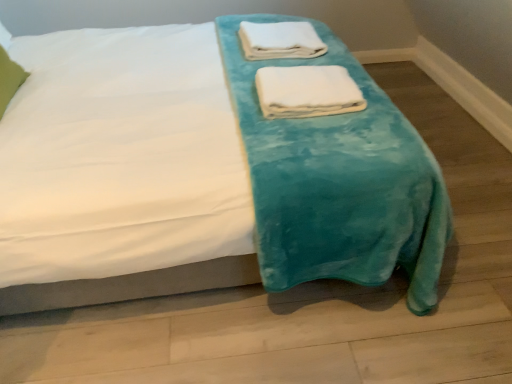
Question: Which direction should I rotate to look at white soft towel at center, acting as the 2th towel starting from the top, — up or down?

Choices:
 (A) up
 (B) down

Answer: (A)

Question: Considering the relative sizes of green fabric pillow at upper left and teal plush blanket at center in the image provided, is green fabric pillow at upper left bigger than teal plush blanket at center?

Choices:
 (A) no
 (B) yes

Answer: (A)

Question: Considering the relative sizes of green fabric pillow at upper left and teal plush blanket at center in the image provided, is green fabric pillow at upper left shorter than teal plush blanket at center?

Choices:
 (A) yes
 (B) no

Answer: (A)

Question: Is green fabric pillow at upper left to the left of teal plush blanket at center from the viewer's perspective?

Choices:
 (A) yes
 (B) no

Answer: (A)

Question: From the image's perspective, is green fabric pillow at upper left on teal plush blanket at center?

Choices:
 (A) no
 (B) yes

Answer: (B)

Question: From a real-world perspective, is green fabric pillow at upper left over teal plush blanket at center?

Choices:
 (A) no
 (B) yes

Answer: (B)

Question: Is green fabric pillow at upper left wider than teal plush blanket at center?

Choices:
 (A) no
 (B) yes

Answer: (A)

Question: Is teal plush blanket at center closer to camera compared to white soft towel at upper center, the 1th towel in the back-to-front sequence?

Choices:
 (A) yes
 (B) no

Answer: (A)

Question: Considering the relative sizes of teal plush blanket at center and white soft towel at upper center, which is the 2th towel from front to back, in the image provided, is teal plush blanket at center wider than white soft towel at upper center, which is the 2th towel from front to back,?

Choices:
 (A) no
 (B) yes

Answer: (B)

Question: From a real-world perspective, is teal plush blanket at center beneath white soft towel at upper center, which is the 2th towel from front to back?

Choices:
 (A) yes
 (B) no

Answer: (A)

Question: Can you confirm if teal plush blanket at center is taller than white soft towel at upper center, which is the 2th towel from front to back?

Choices:
 (A) yes
 (B) no

Answer: (A)

Question: Does teal plush blanket at center appear on the right side of white soft towel at upper center, acting as the 1th towel starting from the top?

Choices:
 (A) no
 (B) yes

Answer: (A)

Question: From the image's perspective, would you say teal plush blanket at center is shown under white soft towel at upper center, the 1th towel in the back-to-front sequence?

Choices:
 (A) yes
 (B) no

Answer: (A)

Question: Is white soft towel at center, the 2th towel in the back-to-front sequence, far from white soft towel at upper center, the 1th towel in the back-to-front sequence?

Choices:
 (A) yes
 (B) no

Answer: (B)